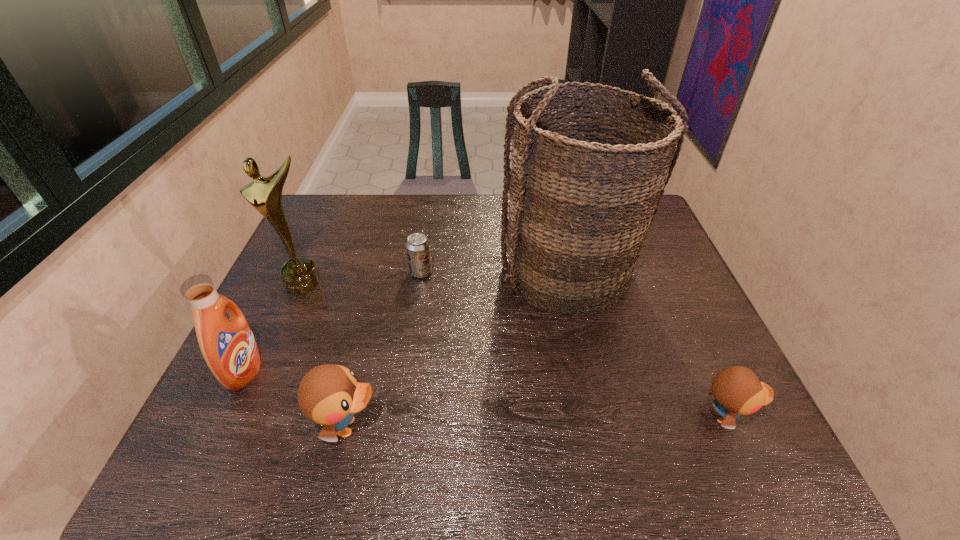
Identify the location of vacant area in the image that satisfies the following two spatial constraints: 1. on the front side of the second object from right to left; 2. on the front-facing side of the detergent. (589, 372).

Locate an element on the screen. Image resolution: width=960 pixels, height=540 pixels. vacant space that satisfies the following two spatial constraints: 1. on the front-facing side of the award; 2. on the front-facing side of the fourth shortest object is located at coordinates (264, 372).

The width and height of the screenshot is (960, 540). I want to click on vacant position in the image that satisfies the following two spatial constraints: 1. on the front-facing side of the award; 2. on the front-facing side of the third tallest object, so click(264, 372).